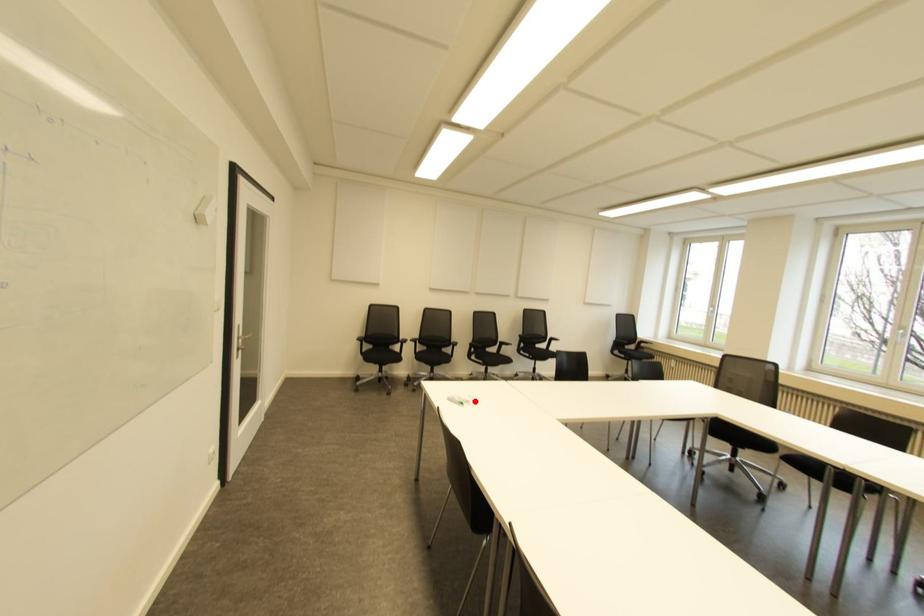
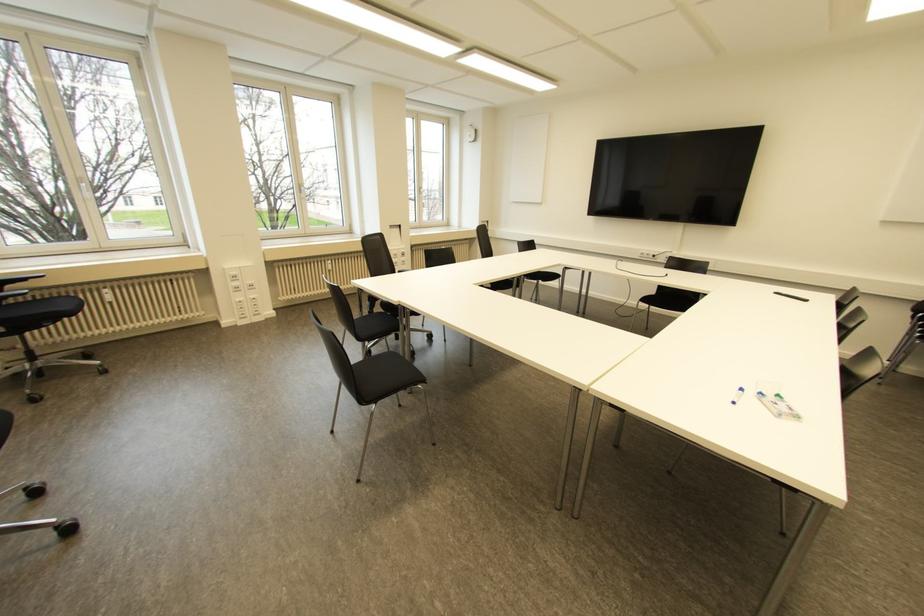
Question: A red point is marked in image1. In image2, is the corresponding 3D point closer to the camera or farther? Reply with the corresponding letter.

Choices:
 (A) The corresponding 3D point is closer.
 (B) The corresponding 3D point is farther.

Answer: (B)